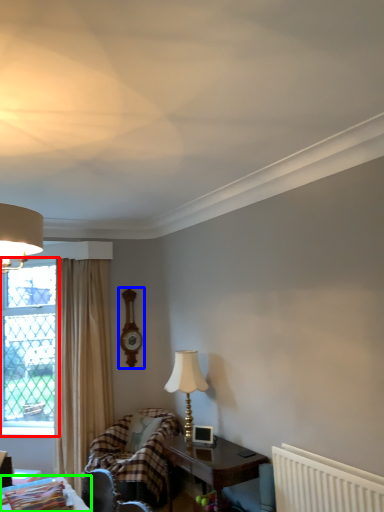
Question: Which is nearer to the window (highlighted by a red box)? clock (highlighted by a blue box) or table (highlighted by a green box).

Choices:
 (A) clock
 (B) table

Answer: (A)